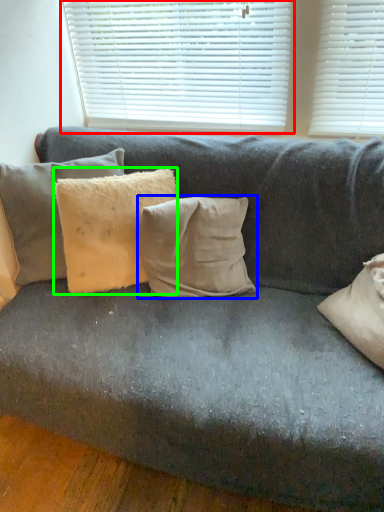
Question: Based on their relative distances, which object is farther from window blind (highlighted by a red box)? Choose from pillow (highlighted by a blue box) and pillow (highlighted by a green box).

Choices:
 (A) pillow
 (B) pillow

Answer: (A)